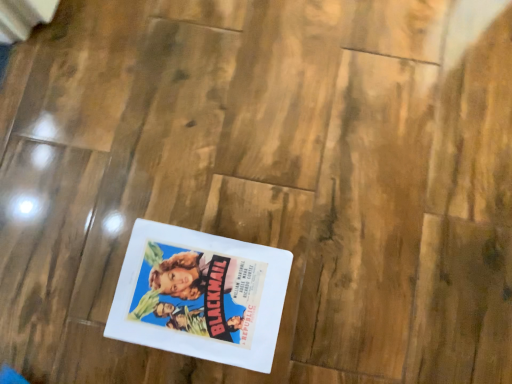
The image size is (512, 384). What are the coordinates of `vacant space underneath white paper at center (from a real-world perspective)` in the screenshot? It's located at (200, 290).